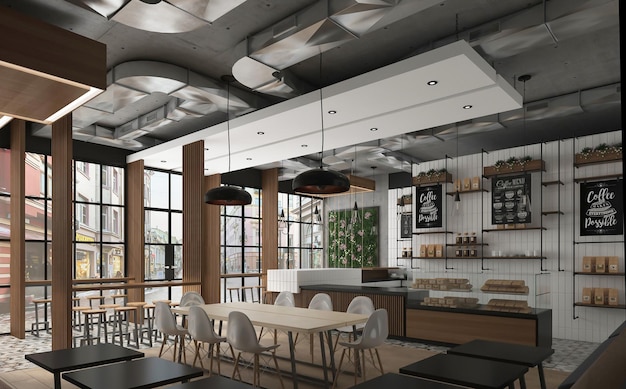
The width and height of the screenshot is (626, 389). Find the location of `wood beams`. wood beams is located at coordinates (16, 213), (62, 209), (131, 225), (193, 231), (211, 231), (269, 234).